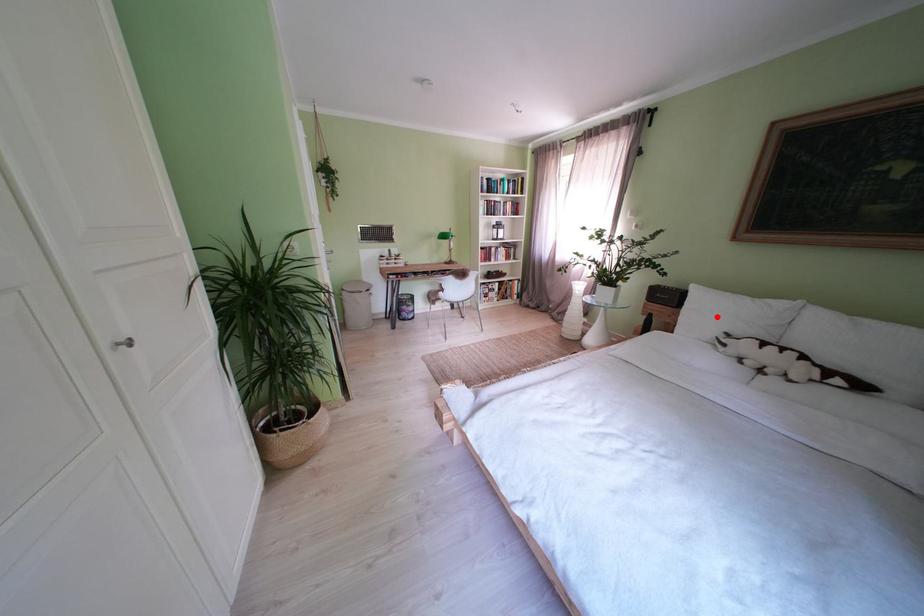
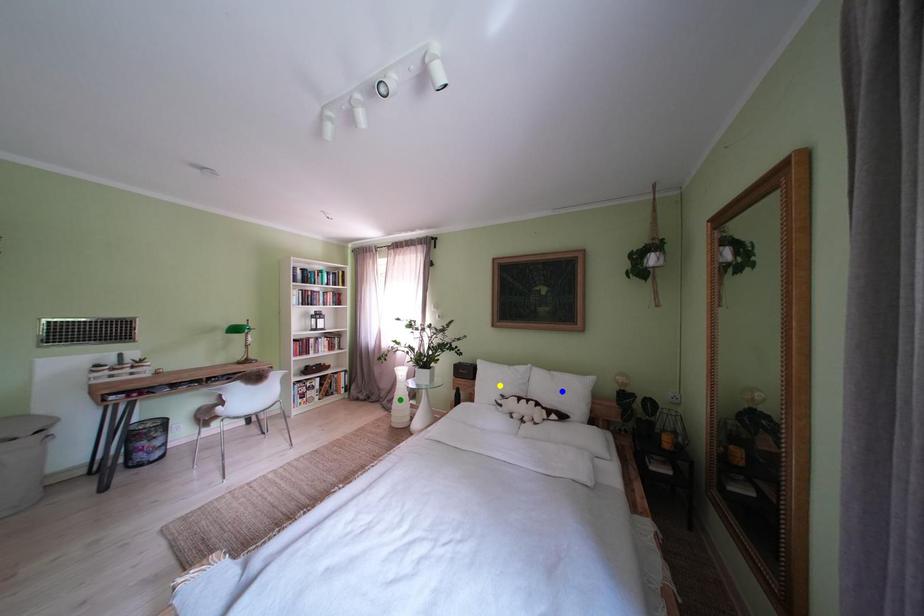
Question: I am providing you with two images of the same scene from different viewpoints. A red point is marked on the first image. You are given multiple points on the second image. Which point in image 2 represents the same 3d spot as the red point in image 1?

Choices:
 (A) blue point
 (B) green point
 (C) yellow point

Answer: (C)